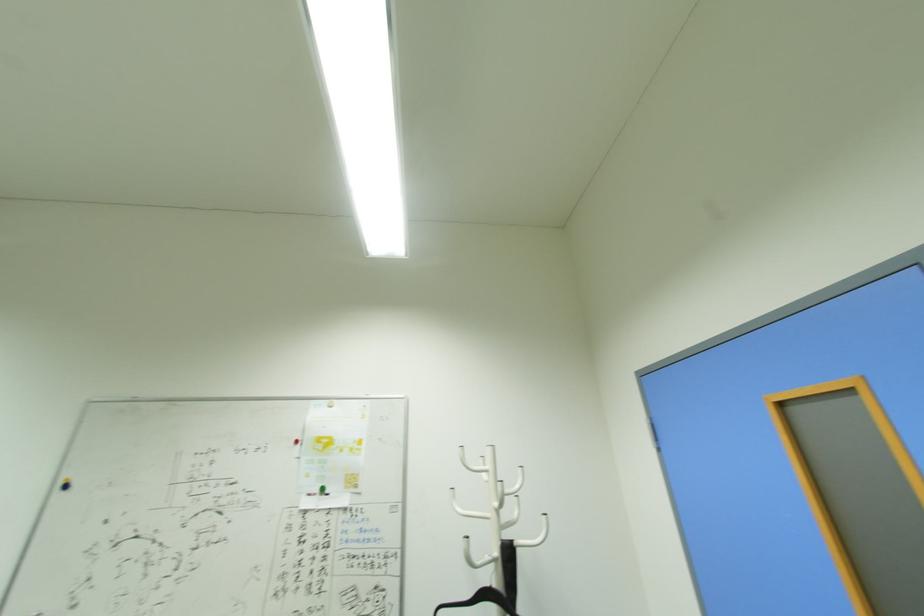
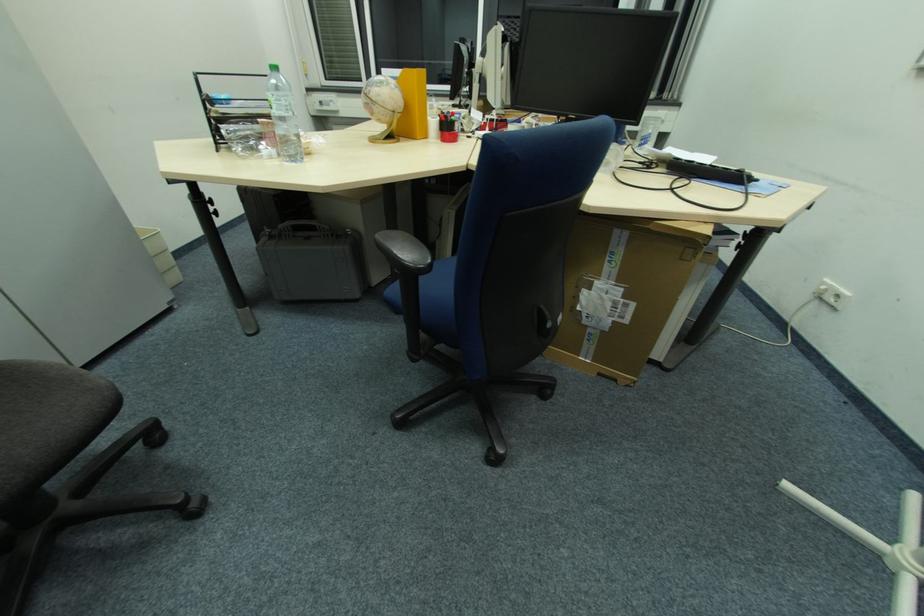
How did the camera likely rotate?

The camera rotated toward left-down.